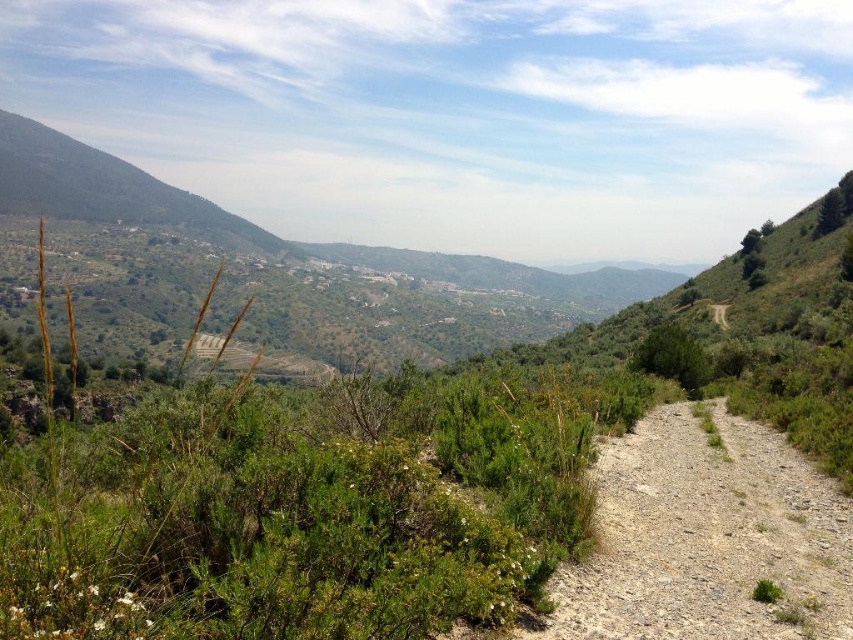
Question: In this image, where is gray gravel path at center-right located relative to dirt/gravel path at center-right?

Choices:
 (A) left
 (B) right

Answer: (A)

Question: Which of the following is the closest to the observer?

Choices:
 (A) gray gravel path at center-right
 (B) dirt/gravel path at center-right

Answer: (A)

Question: From the image, what is the correct spatial relationship of gray gravel path at center-right in relation to dirt/gravel path at center-right?

Choices:
 (A) right
 (B) left

Answer: (B)

Question: Can you confirm if gray gravel path at center-right is positioned to the right of dirt/gravel path at center-right?

Choices:
 (A) yes
 (B) no

Answer: (B)

Question: Which object appears farthest from the camera in this image?

Choices:
 (A) gray gravel path at center-right
 (B) dirt/gravel path at center-right

Answer: (B)

Question: Which object appears farthest from the camera in this image?

Choices:
 (A) gray gravel path at center-right
 (B) dirt/gravel path at center-right

Answer: (B)